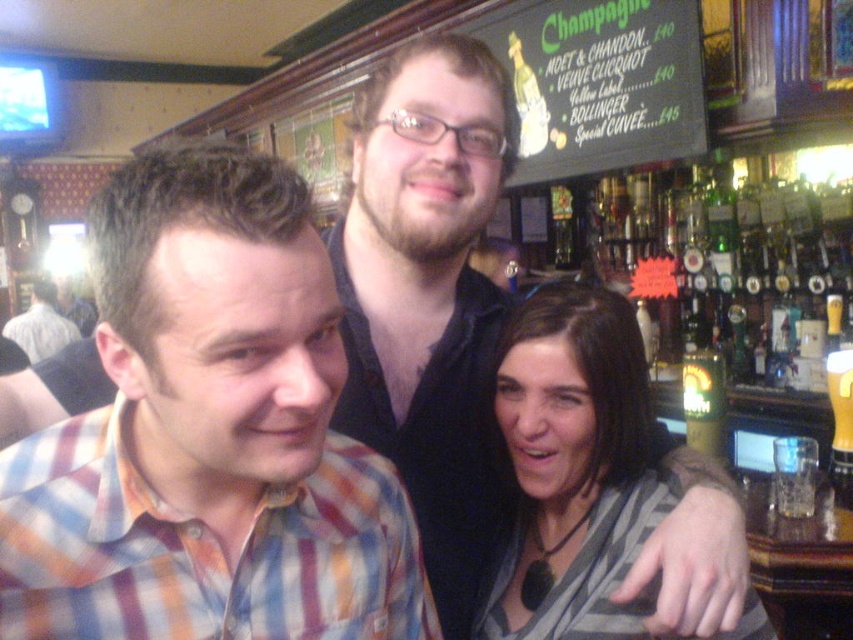
You are a photographer trying to capture a clear shot of the plaid shirt at center and the gray striped scarf at center. Which item is blocking the view of the other?

A: The gray striped scarf at center is blocking the view of the plaid shirt at center because it is positioned in front of it.

You are a bartender at the bar. You need to place a new menu board to the right of the multicolored plaid shirt at center and to the left of the translucent glass mug at upper right. Is this possible?

The multicolored plaid shirt at center is to the left of the translucent glass mug at upper right, so placing the menu board between them is possible as there is space between the two objects.